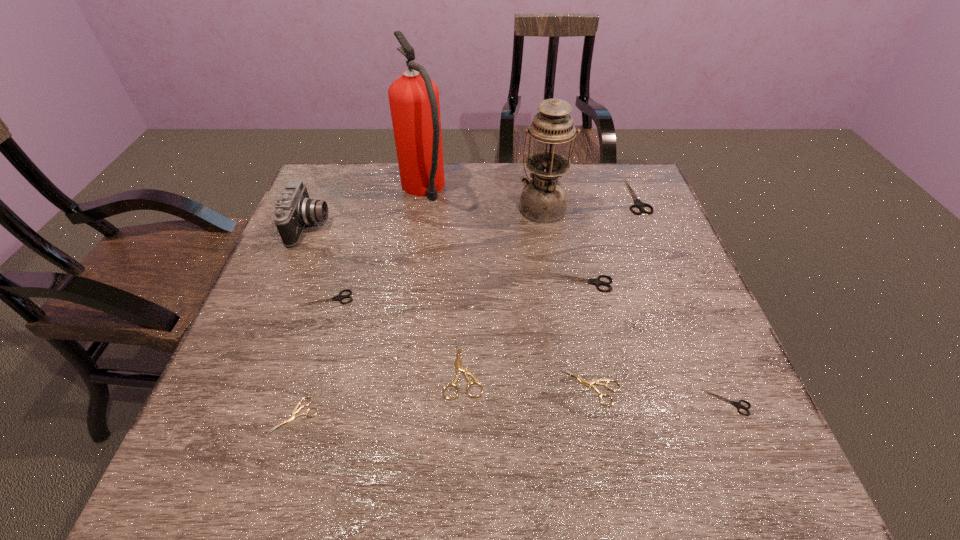
This screenshot has height=540, width=960. I want to click on free point that satisfies the following two spatial constraints: 1. on the back side of the shortest shears; 2. on the left side of the oil lamp, so click(x=360, y=207).

Find the location of a particular element. free location that satisfies the following two spatial constraints: 1. on the front side of the rightmost beige shears; 2. on the right side of the leftmost black shears is located at coordinates (299, 387).